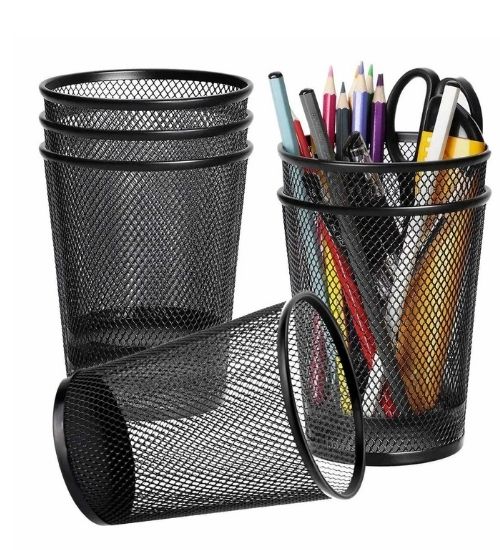
The width and height of the screenshot is (500, 550). I want to click on stacked cups, so click(167, 113), click(170, 145), click(171, 195), click(370, 188), click(378, 263).